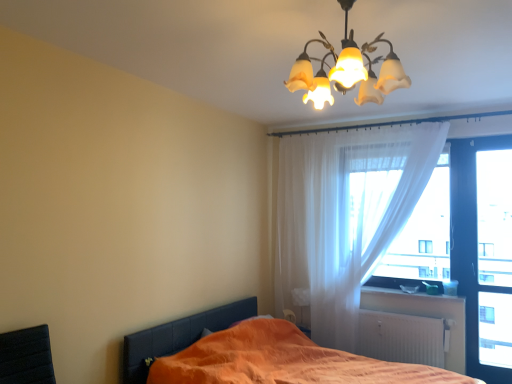
Find the location of a particular element. Image resolution: width=512 pixels, height=384 pixels. free space above transparent glass door at right, the 1th window screen positioned from the right (from a real-world perspective) is located at coordinates (493, 136).